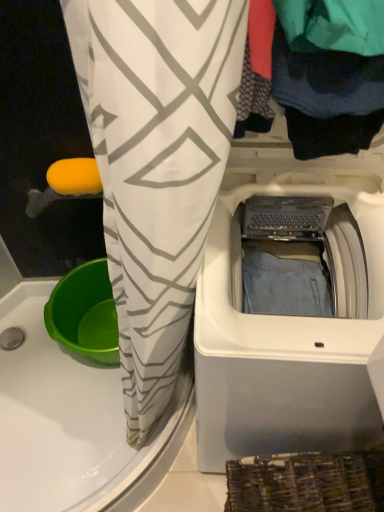
You are a GUI agent. You are given a task and a screenshot of the screen. Output one action in this format:
    pyautogui.click(x=<x>, y=<y>)
    Task: Click on the dark blue fabric at upper right
    
    Given the screenshot: What is the action you would take?
    pyautogui.click(x=308, y=91)

Measure the distance between point [356,95] and camera.

Point [356,95] and camera are 23.35 inches apart.

The image size is (384, 512). What do you see at coordinates (308, 91) in the screenshot?
I see `dark blue fabric at upper right` at bounding box center [308, 91].

Image resolution: width=384 pixels, height=512 pixels. In order to click on white plastic washing machine at upper right in this screenshot , I will do `click(292, 317)`.

Measure the distance between white plastic washing machine at upper right and camera.

white plastic washing machine at upper right and camera are 26.15 inches apart.

The image size is (384, 512). What do you see at coordinates (292, 317) in the screenshot?
I see `white plastic washing machine at upper right` at bounding box center [292, 317].

Where is `dark blue fabric at upper right`? The width and height of the screenshot is (384, 512). dark blue fabric at upper right is located at coordinates (x=308, y=91).

Which is more to the left, white plastic washing machine at upper right or dark blue fabric at upper right?

white plastic washing machine at upper right is more to the left.

Looking at this image, relative to dark blue fabric at upper right, is white plastic washing machine at upper right in front or behind?

white plastic washing machine at upper right is positioned farther from the viewer than dark blue fabric at upper right.

Is point (242, 320) less distant than point (360, 101)?

No.

Based on the photo, from the image's perspective, relative to dark blue fabric at upper right, is white plastic washing machine at upper right above or below?

From the image's perspective, white plastic washing machine at upper right appears below dark blue fabric at upper right.

In the scene shown: From a real-world perspective, is white plastic washing machine at upper right physically above dark blue fabric at upper right?

No, from a real-world perspective, white plastic washing machine at upper right is not on top of dark blue fabric at upper right.

Does white plastic washing machine at upper right have a greater width compared to dark blue fabric at upper right?

Correct, the width of white plastic washing machine at upper right exceeds that of dark blue fabric at upper right.

Who is taller, white plastic washing machine at upper right or dark blue fabric at upper right?

With more height is white plastic washing machine at upper right.

Who is bigger, white plastic washing machine at upper right or dark blue fabric at upper right?

white plastic washing machine at upper right.

Is dark blue fabric at upper right a part of white plastic washing machine at upper right?

No, dark blue fabric at upper right is not inside white plastic washing machine at upper right.

Is white plastic washing machine at upper right far away from dark blue fabric at upper right?

That's not correct — white plastic washing machine at upper right is a little close to dark blue fabric at upper right.

Is white plastic washing machine at upper right facing towards dark blue fabric at upper right?

No, white plastic washing machine at upper right is not aimed at dark blue fabric at upper right.

What's the angular difference between white plastic washing machine at upper right and dark blue fabric at upper right's facing directions?

0.000222 degrees.

How distant is white plastic washing machine at upper right from dark blue fabric at upper right?

white plastic washing machine at upper right is 30.56 centimeters away from dark blue fabric at upper right.

Identify the location of washing machine below the dark blue fabric at upper right (from a real-world perspective). This screenshot has height=512, width=384. coord(292,317).

Can you confirm if dark blue fabric at upper right is positioned to the right of white plastic washing machine at upper right?

Correct, you'll find dark blue fabric at upper right to the right of white plastic washing machine at upper right.

Is dark blue fabric at upper right further to camera compared to white plastic washing machine at upper right?

No, dark blue fabric at upper right is in front of white plastic washing machine at upper right.

Considering the points (332, 79) and (240, 406), which point is behind, point (332, 79) or point (240, 406)?

The point (240, 406) is farther from the camera.

From the image's perspective, which is below, dark blue fabric at upper right or white plastic washing machine at upper right?

From the image's view, white plastic washing machine at upper right is below.

From the picture: From a real-world perspective, who is located lower, dark blue fabric at upper right or white plastic washing machine at upper right?

From a 3D spatial view, white plastic washing machine at upper right is below.

Which of these two, dark blue fabric at upper right or white plastic washing machine at upper right, is wider?

With larger width is white plastic washing machine at upper right.

Who is shorter, dark blue fabric at upper right or white plastic washing machine at upper right?

dark blue fabric at upper right.

In terms of size, does dark blue fabric at upper right appear bigger or smaller than white plastic washing machine at upper right?

In the image, dark blue fabric at upper right appears to be smaller than white plastic washing machine at upper right.

Is dark blue fabric at upper right positioned beyond the bounds of white plastic washing machine at upper right?

That's correct, dark blue fabric at upper right is outside of white plastic washing machine at upper right.

Would you consider dark blue fabric at upper right to be distant from white plastic washing machine at upper right?

They are positioned close to each other.

Is dark blue fabric at upper right oriented towards white plastic washing machine at upper right?

No, dark blue fabric at upper right is not facing towards white plastic washing machine at upper right.

What are the coordinates of `clothing on the right side of white plastic washing machine at upper right` in the screenshot? It's located at (308, 91).

Locate an element on the screen. washing machine located below the dark blue fabric at upper right (from the image's perspective) is located at coordinates (292, 317).

There is a white plastic washing machine at upper right. In order to click on clothing above it (from a real-world perspective) in this screenshot , I will do (x=308, y=91).